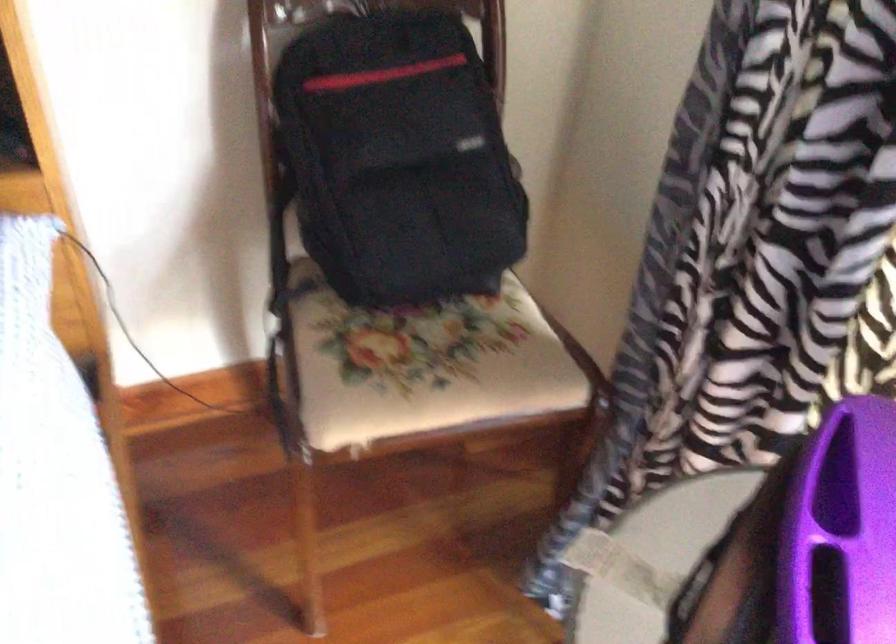
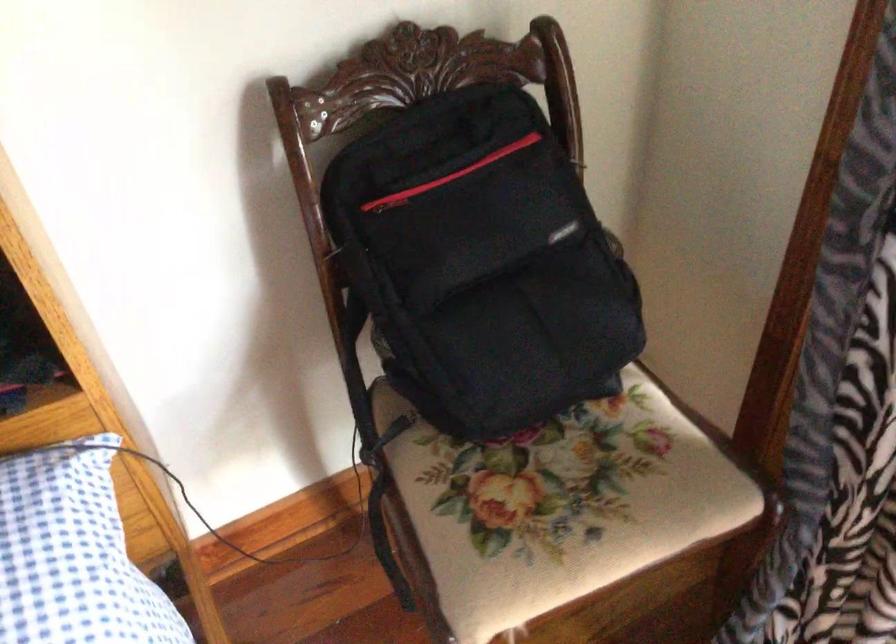
Locate, in the second image, the point that corresponds to the point at 394,153 in the first image.

(480, 263)